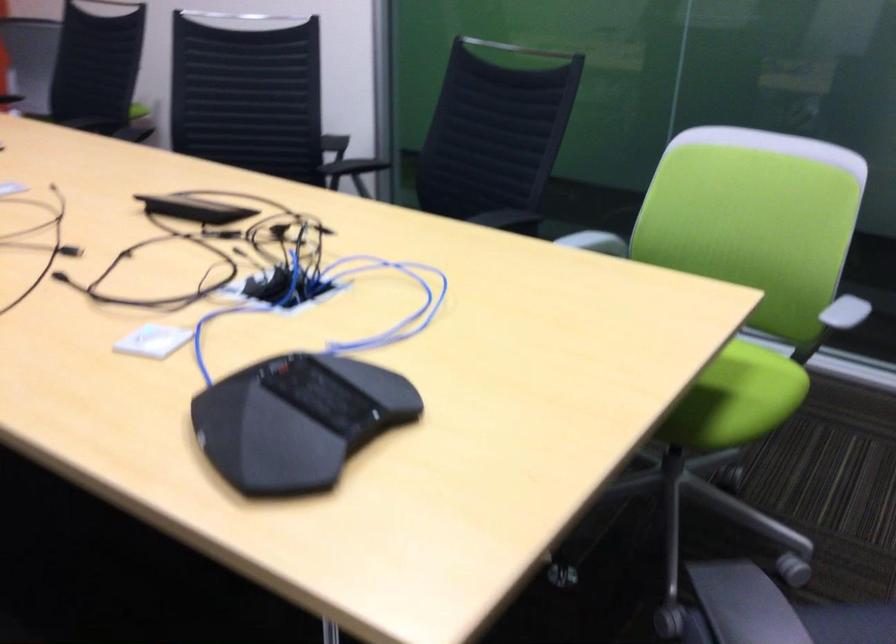
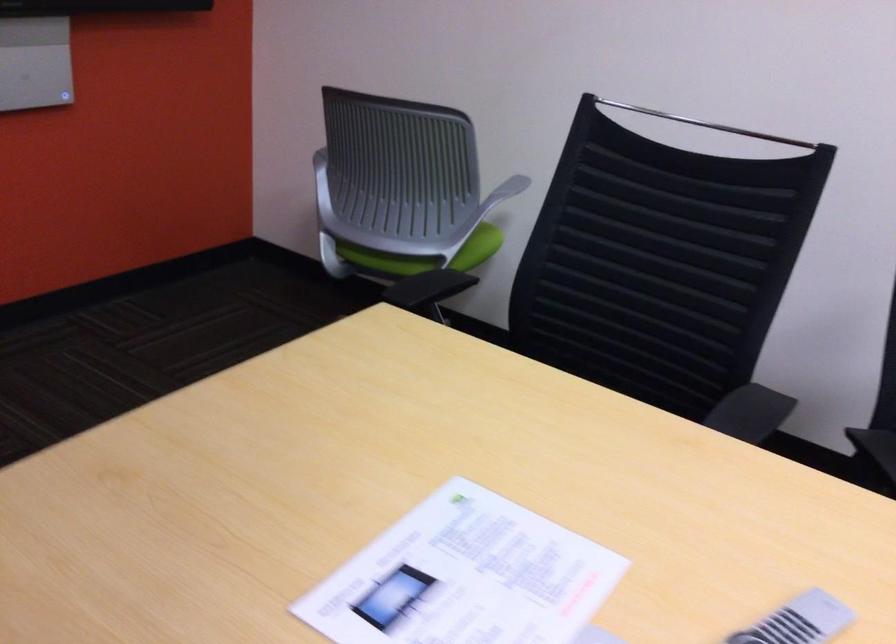
In a continuous first-person perspective shot, in which direction is the camera moving?

The cameraman moved toward left, forward.